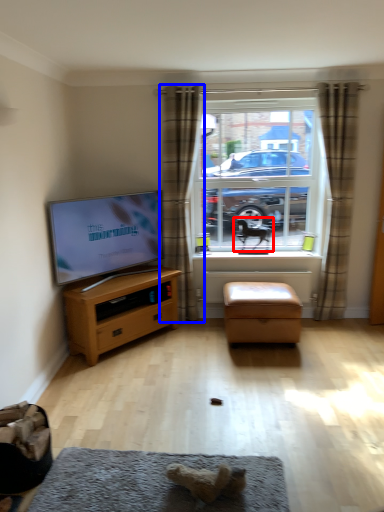
Question: Which object is further to the camera taking this photo, animal (highlighted by a red box) or curtain (highlighted by a blue box)?

Choices:
 (A) animal
 (B) curtain

Answer: (A)